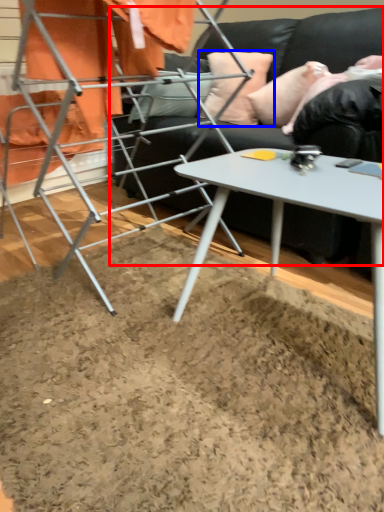
Question: Which point is further to the camera, studio couch (highlighted by a red box) or pillow (highlighted by a blue box)?

Choices:
 (A) studio couch
 (B) pillow

Answer: (B)